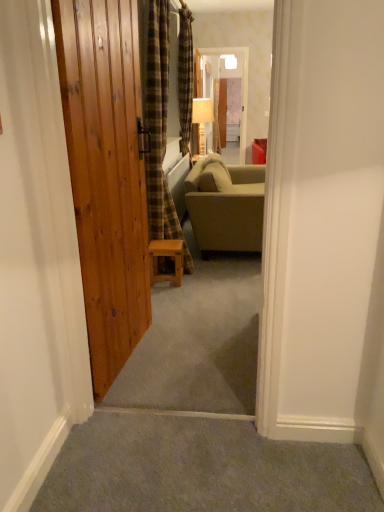
Question: Is plaid fabric curtain at center, which is the second curtain from back to front, positioned behind natural wood door at left?

Choices:
 (A) yes
 (B) no

Answer: (A)

Question: Considering the relative sizes of plaid fabric curtain at center, which is the second curtain from back to front, and natural wood door at left in the image provided, is plaid fabric curtain at center, which is the second curtain from back to front, taller than natural wood door at left?

Choices:
 (A) yes
 (B) no

Answer: (A)

Question: Can you confirm if plaid fabric curtain at center, which is the 1th curtain in front-to-back order, is smaller than natural wood door at left?

Choices:
 (A) no
 (B) yes

Answer: (A)

Question: From a real-world perspective, is plaid fabric curtain at center, which is the second curtain from back to front, physically above natural wood door at left?

Choices:
 (A) yes
 (B) no

Answer: (A)

Question: Is plaid fabric curtain at center, which is the second curtain from back to front, wider than natural wood door at left?

Choices:
 (A) no
 (B) yes

Answer: (B)

Question: From the image's perspective, is plaid fabric curtain at center, which is the 1th curtain in front-to-back order, located above natural wood door at left?

Choices:
 (A) no
 (B) yes

Answer: (B)

Question: Is plaid fabric curtain at center, which is the second curtain from back to front, to the right of translucent plastic screen door at center from the viewer's perspective?

Choices:
 (A) no
 (B) yes

Answer: (A)

Question: Is plaid fabric curtain at center, which is the 1th curtain in front-to-back order, closer to camera compared to translucent plastic screen door at center?

Choices:
 (A) yes
 (B) no

Answer: (A)

Question: Is the depth of plaid fabric curtain at center, which is the second curtain from back to front, greater than that of translucent plastic screen door at center?

Choices:
 (A) no
 (B) yes

Answer: (A)

Question: From the image's perspective, is plaid fabric curtain at center, which is the second curtain from back to front, located above translucent plastic screen door at center?

Choices:
 (A) yes
 (B) no

Answer: (B)

Question: From a real-world perspective, does plaid fabric curtain at center, which is the second curtain from back to front, stand above translucent plastic screen door at center?

Choices:
 (A) no
 (B) yes

Answer: (A)

Question: From the image's perspective, is plaid fabric curtain at center, which is the 1th curtain in front-to-back order, under translucent plastic screen door at center?

Choices:
 (A) yes
 (B) no

Answer: (A)

Question: From a real-world perspective, is translucent plastic screen door at center on natural wood door at left?

Choices:
 (A) no
 (B) yes

Answer: (B)